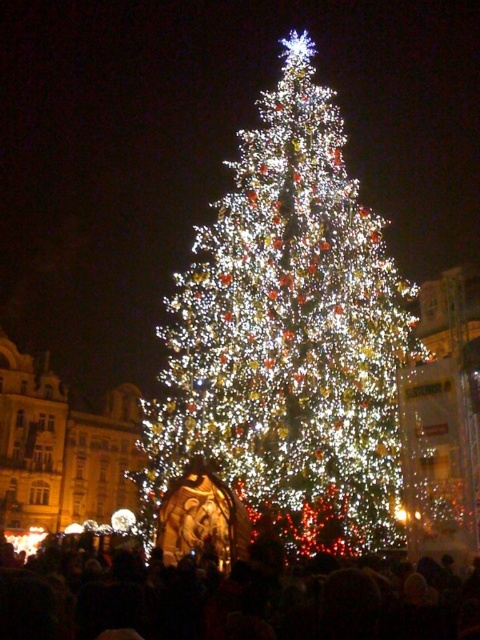
You are a photographer trying to capture the illuminated white christmas tree at center and the black matte crowd at lower center in a single shot. Based on their sizes, which object should you focus on first to ensure both are in frame?

The illuminated white christmas tree at center is larger than the black matte crowd at lower center, so you should focus on the illuminated white christmas tree at center first to ensure it fits properly in the frame, allowing space for the smaller crowd.

You are a photographer trying to capture the illuminated white christmas tree at center and the black matte crowd at lower center in a single shot. Which object should you position closer to the left side of the frame to ensure both are visible?

The black matte crowd at lower center should be positioned closer to the left side of the frame since the illuminated white christmas tree at center is on its right side.

You are a photographer trying to capture the illuminated white christmas tree at center and the black matte crowd at lower center in a single shot. Based on their sizes, will the tree appear taller than the crowd in the photo?

The illuminated white christmas tree at center has a greater height compared to the black matte crowd at lower center, so yes, the tree will appear taller than the crowd in the photo.